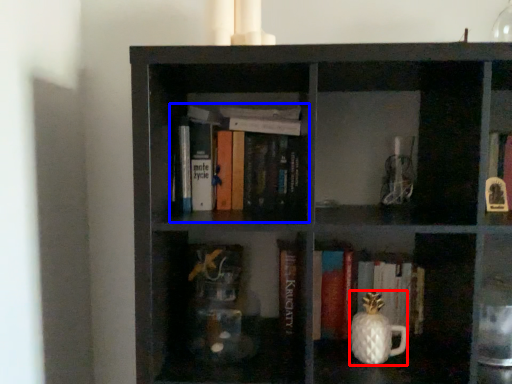
Question: Which of the following is the farthest to the observer, tea pot (highlighted by a red box) or book (highlighted by a blue box)?

Choices:
 (A) tea pot
 (B) book

Answer: (B)